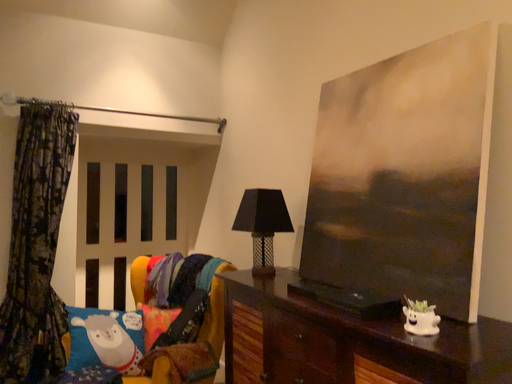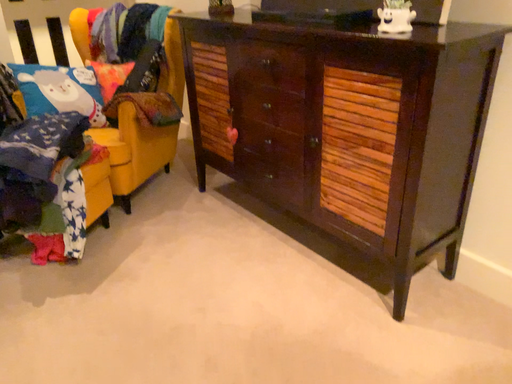
Question: Which way did the camera rotate in the video?

Choices:
 (A) rotated left
 (B) rotated right

Answer: (B)